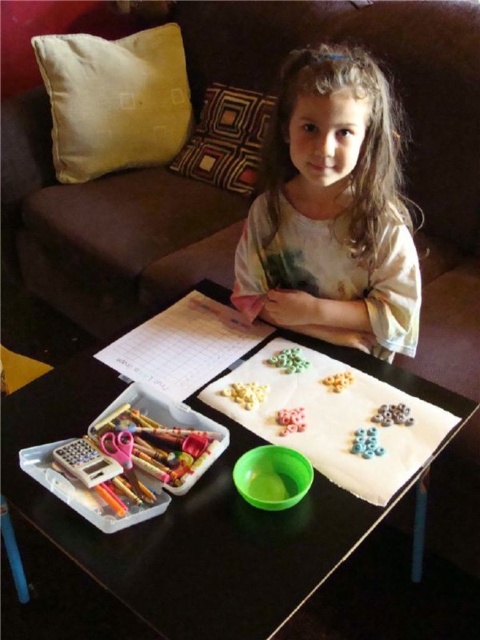
Between light brown tie-dye shirt at center and beige fabric pillow at upper left, which one has more height?

With more height is beige fabric pillow at upper left.

At what (x,y) coordinates should I click in order to perform the action: click on light brown tie-dye shirt at center. Please return your answer as a coordinate pair (x, y). Looking at the image, I should click on click(x=333, y=211).

Is velvet brown couch at upper center above beige fabric pillow at upper left?

No.

Who is more forward, (372, 20) or (54, 90)?

Point (372, 20) is more forward.

Find the location of a particular element. velvet brown couch at upper center is located at coordinates (409, 125).

Can you confirm if velvet brown couch at upper center is taller than green plastic bowl at lower center?

Yes.

The height and width of the screenshot is (640, 480). Identify the location of velvet brown couch at upper center. (409, 125).

Find the location of a particular element. velvet brown couch at upper center is located at coordinates (409, 125).